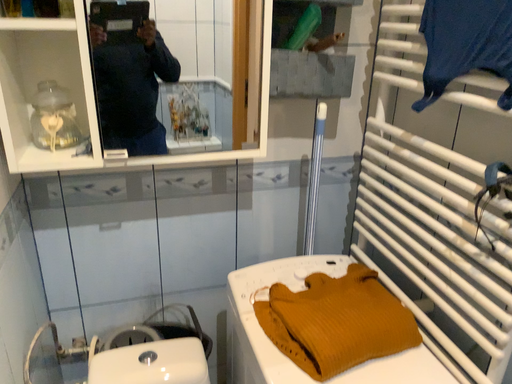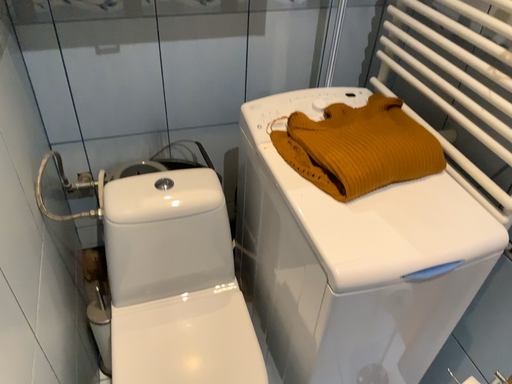
Question: Which way did the camera rotate in the video?

Choices:
 (A) rotated downward
 (B) rotated upward

Answer: (A)